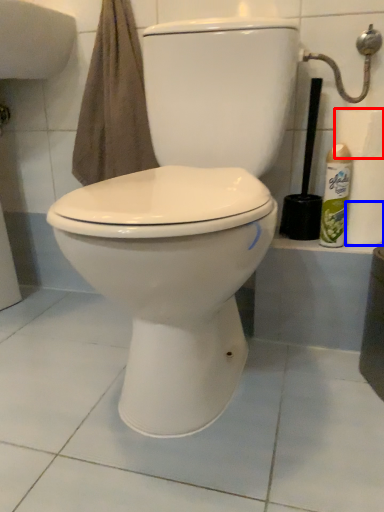
Question: Which of the following is the closest to the observer, toilet paper (highlighted by a red box) or toilet paper (highlighted by a blue box)?

Choices:
 (A) toilet paper
 (B) toilet paper

Answer: (A)